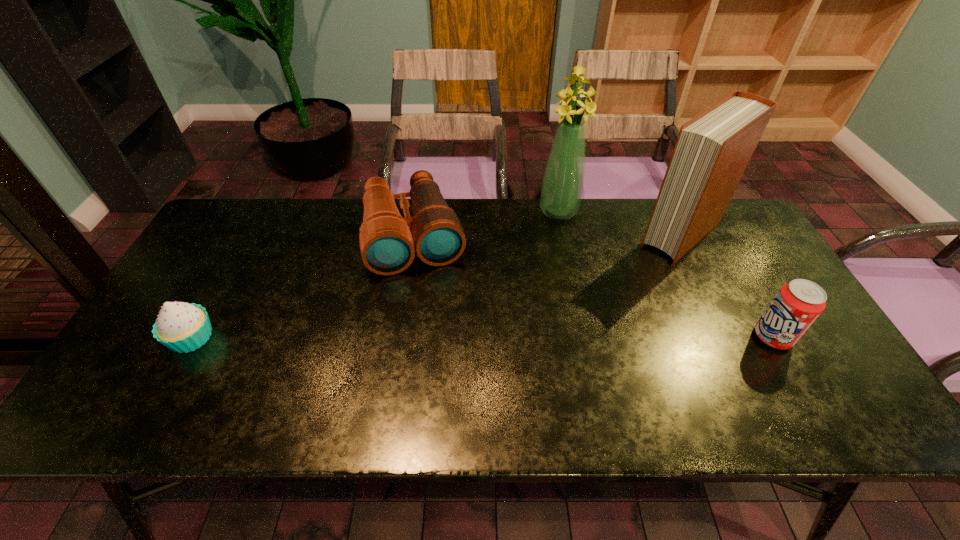
Locate an element on the screen. This screenshot has height=540, width=960. hardback book located in the far edge section of the desktop is located at coordinates (713, 149).

What are the coordinates of `binoculars positioned at the far edge` in the screenshot? It's located at (386, 244).

This screenshot has width=960, height=540. Identify the location of object that is at the left edge. (182, 327).

This screenshot has height=540, width=960. Find the location of `soda can located at the right edge`. soda can located at the right edge is located at coordinates (797, 305).

This screenshot has height=540, width=960. I want to click on hardback book located in the right edge section of the desktop, so click(x=713, y=149).

Where is `object that is at the far right corner`? Image resolution: width=960 pixels, height=540 pixels. object that is at the far right corner is located at coordinates (713, 149).

Image resolution: width=960 pixels, height=540 pixels. I want to click on vacant area at the far edge of the desktop, so tap(513, 247).

In order to click on blank space at the near edge of the desktop in this screenshot , I will do `click(207, 367)`.

Locate an element on the screen. vacant space at the left edge of the desktop is located at coordinates (203, 262).

You are a GUI agent. You are given a task and a screenshot of the screen. Output one action in this format:
    pyautogui.click(x=<x>, y=<y>)
    Task: Click on the vacant region at the right edge of the desktop
    Image resolution: width=960 pixels, height=540 pixels.
    Given the screenshot: What is the action you would take?
    pyautogui.click(x=773, y=355)